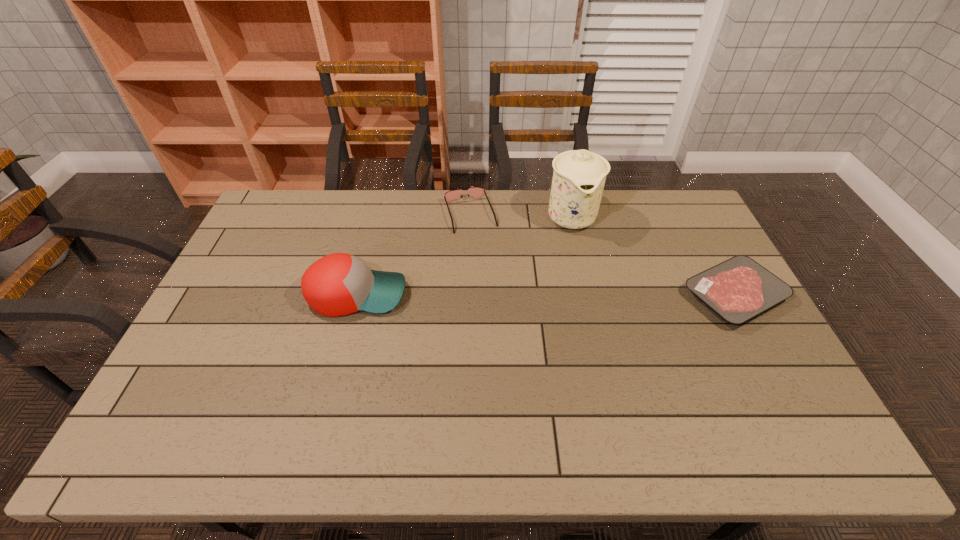
Where is `vacant space situated 0.200m on the bridge of the second object from left to right`? The width and height of the screenshot is (960, 540). vacant space situated 0.200m on the bridge of the second object from left to right is located at coordinates click(492, 273).

Where is `free location located 0.290m on the bridge of the second object from left to right`? The height and width of the screenshot is (540, 960). free location located 0.290m on the bridge of the second object from left to right is located at coordinates (499, 294).

Identify the location of vacant position located 0.160m on the bridge of the second object from left to right. (488, 265).

The image size is (960, 540). Find the location of `free region located 0.320m on the spout of the chinaware`. free region located 0.320m on the spout of the chinaware is located at coordinates (602, 314).

The height and width of the screenshot is (540, 960). In order to click on free space located 0.320m on the spout of the chinaware in this screenshot , I will do `click(602, 314)`.

Locate an element on the screen. This screenshot has height=540, width=960. vacant space located 0.370m on the spout of the chinaware is located at coordinates (606, 328).

Locate an element on the screen. sunglasses present at the far edge is located at coordinates (476, 192).

You are a GUI agent. You are given a task and a screenshot of the screen. Output one action in this format:
    pyautogui.click(x=<x>, y=<y>)
    Task: Click on the chinaware that is at the far edge
    This screenshot has height=540, width=960.
    Given the screenshot: What is the action you would take?
    pyautogui.click(x=579, y=176)

Where is `object present at the right edge`? The height and width of the screenshot is (540, 960). object present at the right edge is located at coordinates (738, 289).

In the image, there is a desktop. Where is `vacant space at the far edge`? This screenshot has width=960, height=540. vacant space at the far edge is located at coordinates (625, 217).